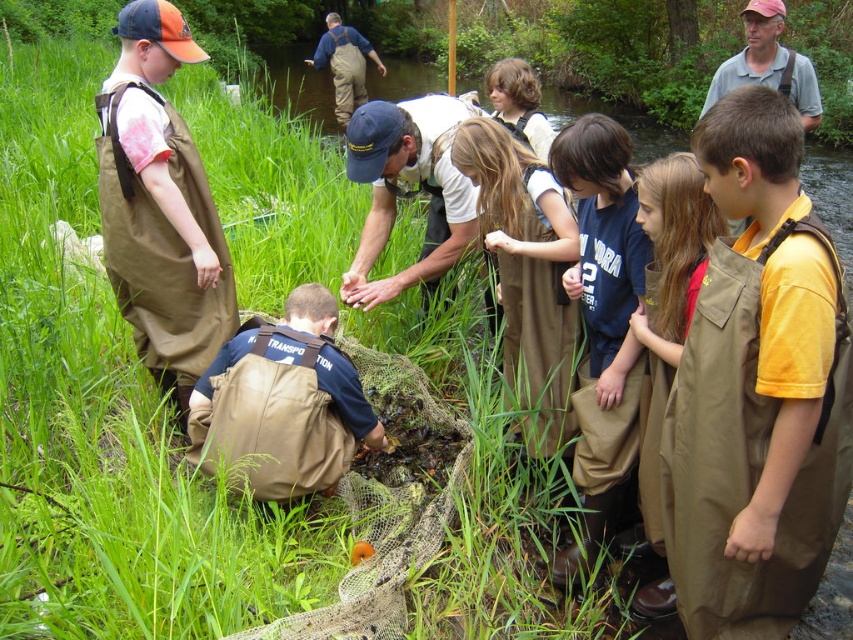
Question: Does brown leather vest at center have a larger size compared to brown waterproof apron at center?

Choices:
 (A) yes
 (B) no

Answer: (B)

Question: Does dark blue t-shirt at center have a smaller size compared to brown waterproof apron at center?

Choices:
 (A) yes
 (B) no

Answer: (A)

Question: Which of the following is the farthest from the observer?

Choices:
 (A) (572, 371)
 (B) (254, 380)

Answer: (A)

Question: Among these points, which one is farthest from the camera?

Choices:
 (A) (345, 278)
 (B) (605, 346)

Answer: (A)

Question: Which of the following is the farthest from the observer?

Choices:
 (A) (524, 257)
 (B) (349, 148)

Answer: (B)

Question: Can you confirm if brown canvas apron at center is positioned to the left of khakimaterial at left?

Choices:
 (A) no
 (B) yes

Answer: (A)